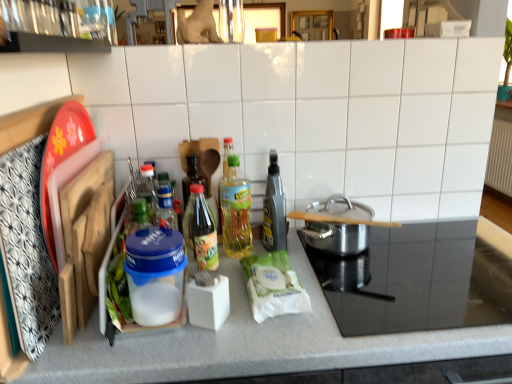
The height and width of the screenshot is (384, 512). Identify the location of unoccupied region to the right of white matte paper towel at center. (350, 296).